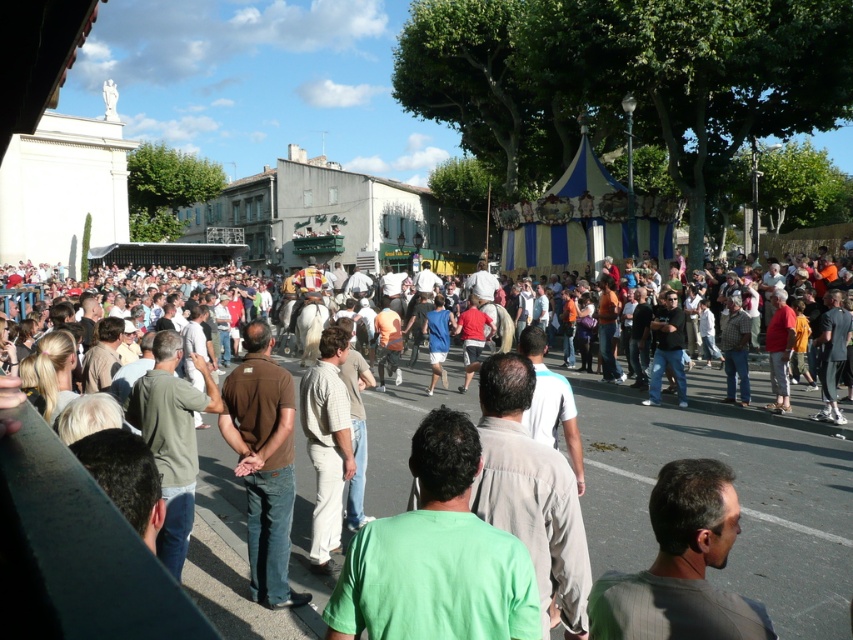
You are a photographer standing in the crowd and want to take a photo of the green matte shirt at center and the light beige pants at center. Which one should you focus on first if you want to capture both in the same frame?

The green matte shirt at center is above the light beige pants at center, so you should focus on the light beige pants at center first to ensure both are in the frame.